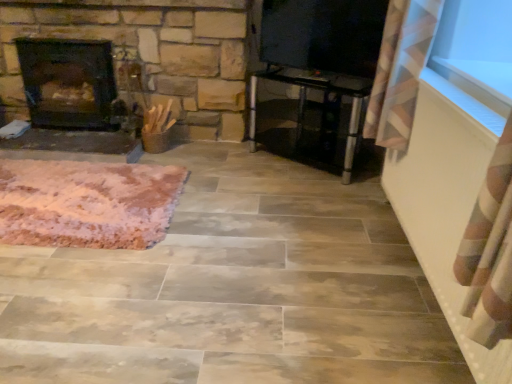
Question: Is pink fluffy rug at lower left wider than dark brown stone fireplace at left?

Choices:
 (A) yes
 (B) no

Answer: (A)

Question: Is pink fluffy rug at lower left outside of dark brown stone fireplace at left?

Choices:
 (A) yes
 (B) no

Answer: (A)

Question: Would you say pink fluffy rug at lower left is a long distance from dark brown stone fireplace at left?

Choices:
 (A) yes
 (B) no

Answer: (B)

Question: Can you confirm if pink fluffy rug at lower left is positioned to the left of dark brown stone fireplace at left?

Choices:
 (A) yes
 (B) no

Answer: (B)

Question: Considering the relative sizes of pink fluffy rug at lower left and dark brown stone fireplace at left in the image provided, is pink fluffy rug at lower left taller than dark brown stone fireplace at left?

Choices:
 (A) yes
 (B) no

Answer: (B)

Question: From a real-world perspective, is pink fluffy rug at lower left on top of dark brown stone fireplace at left?

Choices:
 (A) yes
 (B) no

Answer: (B)

Question: From the image's perspective, is transparent glass table at center above pink fluffy rug at lower left?

Choices:
 (A) yes
 (B) no

Answer: (A)

Question: Is pink fluffy rug at lower left inside transparent glass table at center?

Choices:
 (A) yes
 (B) no

Answer: (B)

Question: Is transparent glass table at center thinner than pink fluffy rug at lower left?

Choices:
 (A) yes
 (B) no

Answer: (A)

Question: Does transparent glass table at center have a lesser height compared to pink fluffy rug at lower left?

Choices:
 (A) yes
 (B) no

Answer: (B)

Question: Does transparent glass table at center lie in front of pink fluffy rug at lower left?

Choices:
 (A) yes
 (B) no

Answer: (B)

Question: Is transparent glass table at center located outside pink fluffy rug at lower left?

Choices:
 (A) no
 (B) yes

Answer: (B)

Question: Does transparent glass window screen at upper right have a lesser height compared to dark brown stone fireplace at left?

Choices:
 (A) no
 (B) yes

Answer: (B)